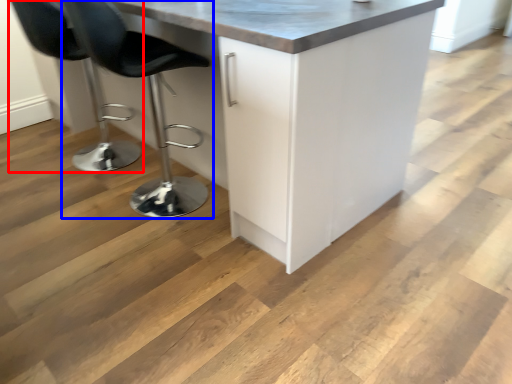
Question: Which point is closer to the camera, chair (highlighted by a red box) or chair (highlighted by a blue box)?

Choices:
 (A) chair
 (B) chair

Answer: (B)